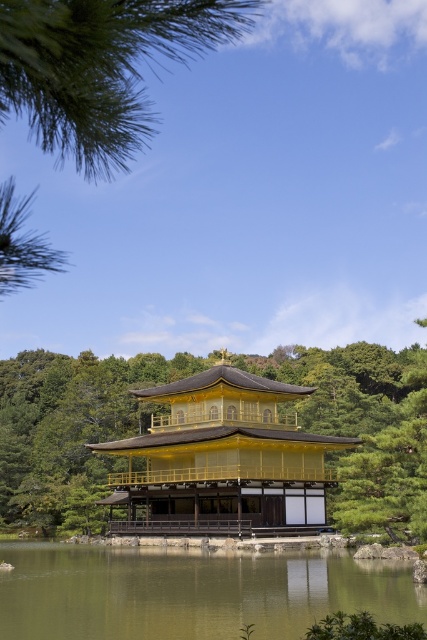
Question: Which object is positioned farthest from the green liquid water at center?

Choices:
 (A) gold lacquered wood temple at center
 (B) green needle-like leaves at upper left

Answer: (B)

Question: Can you confirm if green liquid water at center is positioned above gold lacquered wood temple at center?

Choices:
 (A) no
 (B) yes

Answer: (A)

Question: Which object appears closest to the camera in this image?

Choices:
 (A) green needle-like leaves at upper left
 (B) gold lacquered wood temple at center

Answer: (A)

Question: Does green liquid water at center appear on the left side of gold lacquered wood temple at center?

Choices:
 (A) no
 (B) yes

Answer: (B)

Question: Does green liquid water at center have a lesser width compared to gold lacquered wood temple at center?

Choices:
 (A) no
 (B) yes

Answer: (A)

Question: Which object appears closest to the camera in this image?

Choices:
 (A) green liquid water at center
 (B) gold lacquered wood temple at center

Answer: (A)